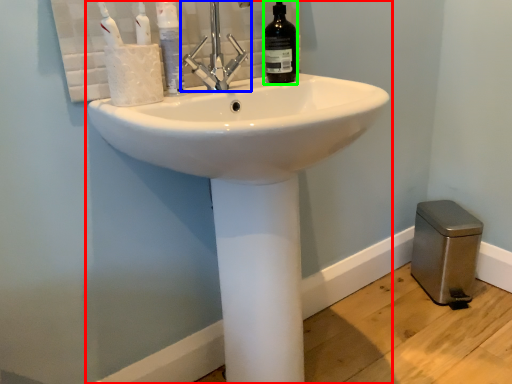
Question: Which is nearer to the sink (highlighted by a red box)? tap (highlighted by a blue box) or bottle (highlighted by a green box).

Choices:
 (A) tap
 (B) bottle

Answer: (A)